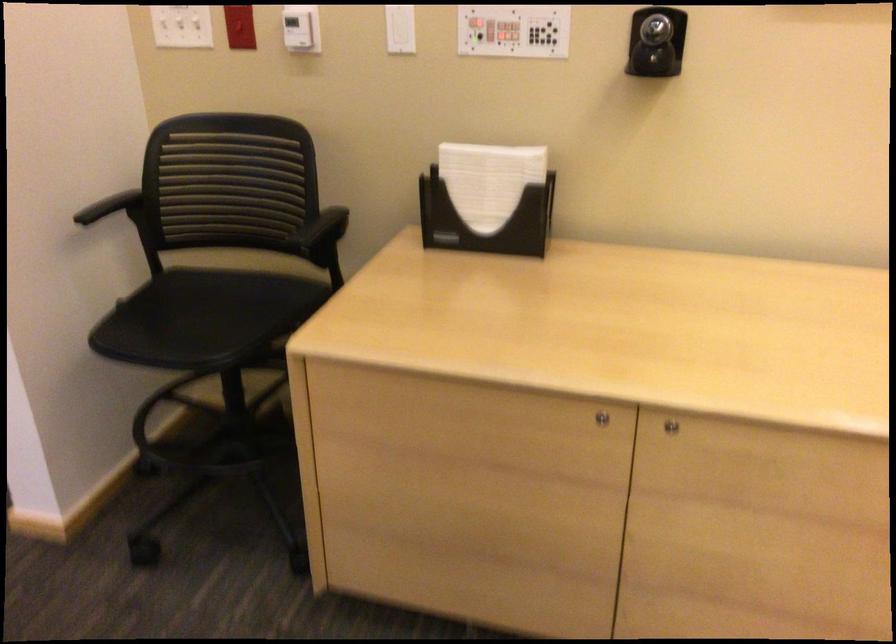
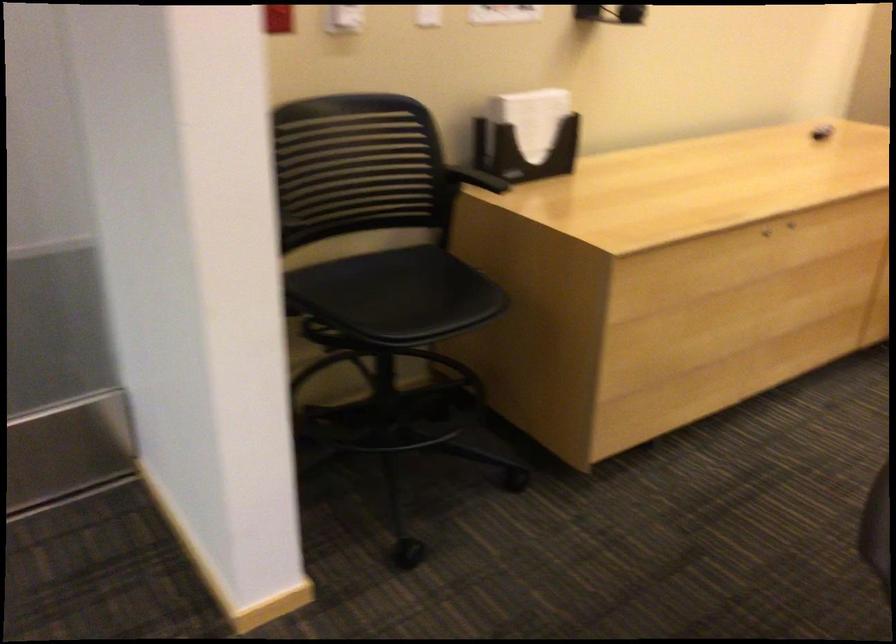
In the second image, find the point that corresponds to pixel 698 406 in the first image.

(790, 225)